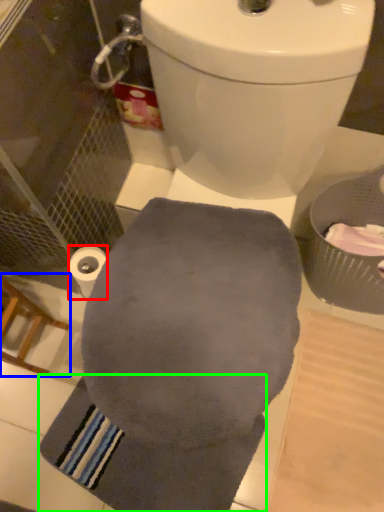
Question: Which object is the closest to the toilet paper (highlighted by a red box)? Choose among these: chair (highlighted by a blue box) or bath towel (highlighted by a green box).

Choices:
 (A) chair
 (B) bath towel

Answer: (A)